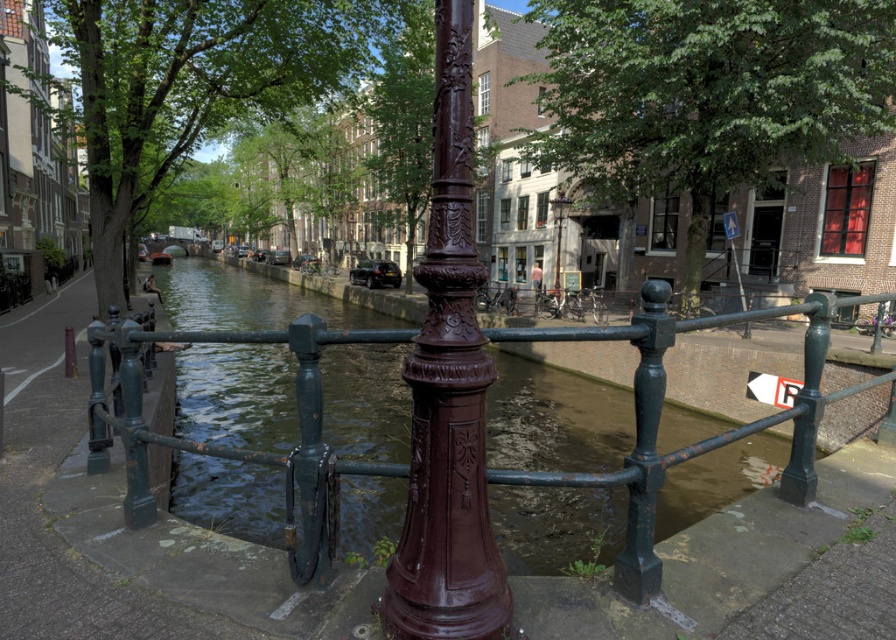
Between glossy burgundy post at center and metallic blue sign at upper right, which one has more height?

metallic blue sign at upper right

Which of these two, glossy burgundy post at center or metallic blue sign at upper right, stands shorter?

With less height is glossy burgundy post at center.

Find the location of a particular element. The width and height of the screenshot is (896, 640). glossy burgundy post at center is located at coordinates (448, 394).

Does green matte fence at center have a greater width compared to metallic blue sign at upper right?

Yes, green matte fence at center is wider than metallic blue sign at upper right.

Identify the location of green matte fence at center. (264, 451).

Does point (458, 346) come farther from viewer compared to point (556, 216)?

No, (458, 346) is closer to viewer.

Is glossy burgundy post at center wider than polished bronze lamp post at center?

No.

Identify the location of glossy burgundy post at center. This screenshot has width=896, height=640. (448, 394).